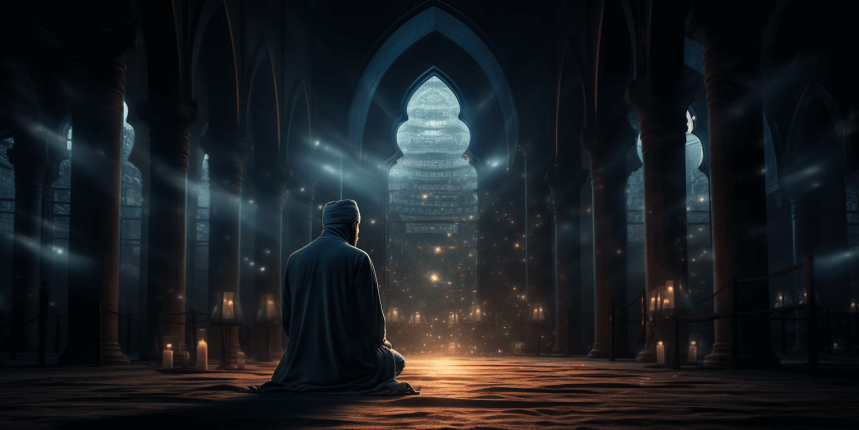
Identify the location of candle flame. The height and width of the screenshot is (430, 859). (168, 346), (659, 343), (691, 344).